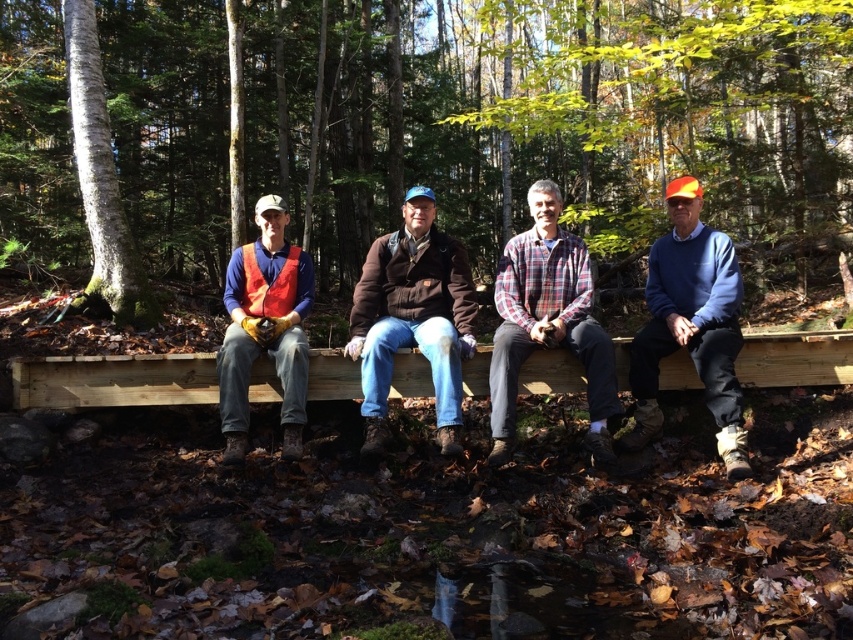
You are a photographer trying to capture a group photo of the brown leather jacket at center and the matte orange vest at left. Since you want both subjects to appear the same size in the photo, where should you position yourself relative to them?

Since the brown leather jacket at center is larger in size than the matte orange vest at left, you should move closer to the matte orange vest at left and farther from the brown leather jacket at center to make them appear the same size in the photo.

You are a photographer standing in front of the light brown wood bench at center. You want to take a photo of the matte black jacket at center without any obstructions. Since the bench is between you and the jacket, will the bench block your view of the jacket?

The matte black jacket at center is much taller than the light brown wood bench at center, so the bench will not block your view of the jacket.